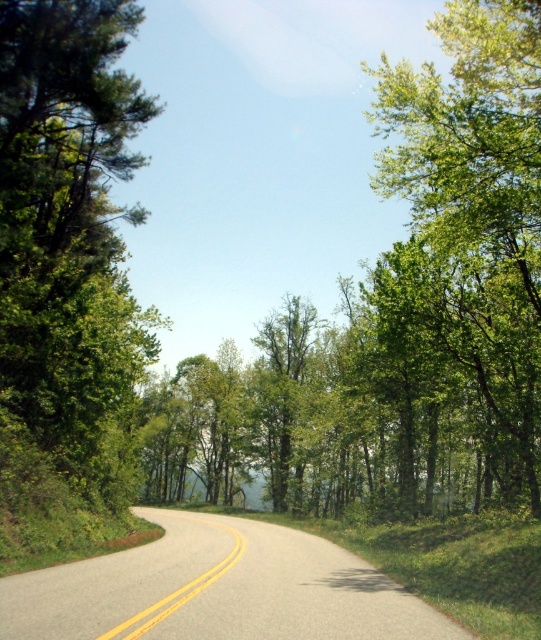
Question: Does green leafy tree at left have a lesser width compared to green leafy tree at center?

Choices:
 (A) yes
 (B) no

Answer: (A)

Question: Which point is farther from the camera taking this photo?

Choices:
 (A) (263, 422)
 (B) (537, 444)

Answer: (A)

Question: Which is nearer to the green leafy tree at left?

Choices:
 (A) green leafy tree at center
 (B) green leafy tree at upper right

Answer: (B)

Question: Is green leafy tree at upper right below green leafy tree at center?

Choices:
 (A) yes
 (B) no

Answer: (B)

Question: From the image, what is the correct spatial relationship of green leafy tree at left in relation to green leafy tree at center?

Choices:
 (A) above
 (B) below

Answer: (A)

Question: Which object is the farthest from the green leafy tree at center?

Choices:
 (A) green leafy tree at left
 (B) green leafy tree at upper right

Answer: (A)